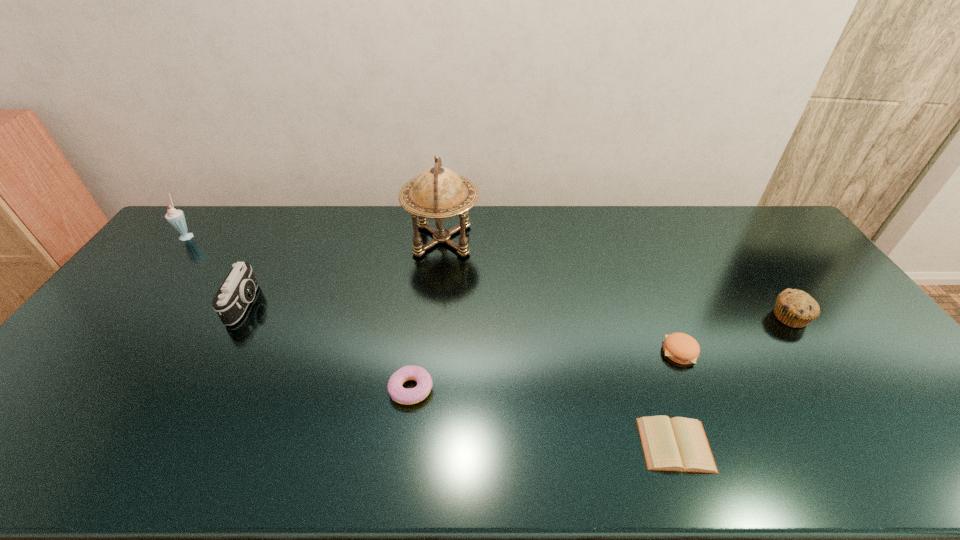
The width and height of the screenshot is (960, 540). Identify the location of unoccupied area between the sixth object from right to left and the fourth shortest object. (517, 310).

The height and width of the screenshot is (540, 960). I want to click on free space between the second tallest object and the nearest object, so click(432, 340).

Locate an element on the screen. The image size is (960, 540). free space between the fifth farthest object and the fifth shortest object is located at coordinates (462, 328).

Find the location of a particular element. unoccupied position between the leftmost object and the doughnut is located at coordinates (300, 312).

Image resolution: width=960 pixels, height=540 pixels. Identify the location of empty space that is in between the camera and the doughnut. (328, 347).

I want to click on empty space that is in between the shortest object and the second object from left to right, so click(x=461, y=374).

Identify the location of vacant area that lies between the globe and the milkshake. This screenshot has width=960, height=540. (315, 238).

The width and height of the screenshot is (960, 540). Find the location of `free area in between the sixth shortest object and the globe`. free area in between the sixth shortest object and the globe is located at coordinates (315, 238).

Identify the location of free space between the doughnut and the fifth shortest object. point(328,347).

You are a GUI agent. You are given a task and a screenshot of the screen. Output one action in this format:
    pyautogui.click(x=<x>, y=<y>)
    Task: Click on the second closest object to the fifth shortest object
    This screenshot has height=540, width=960.
    Given the screenshot: What is the action you would take?
    pyautogui.click(x=438, y=193)